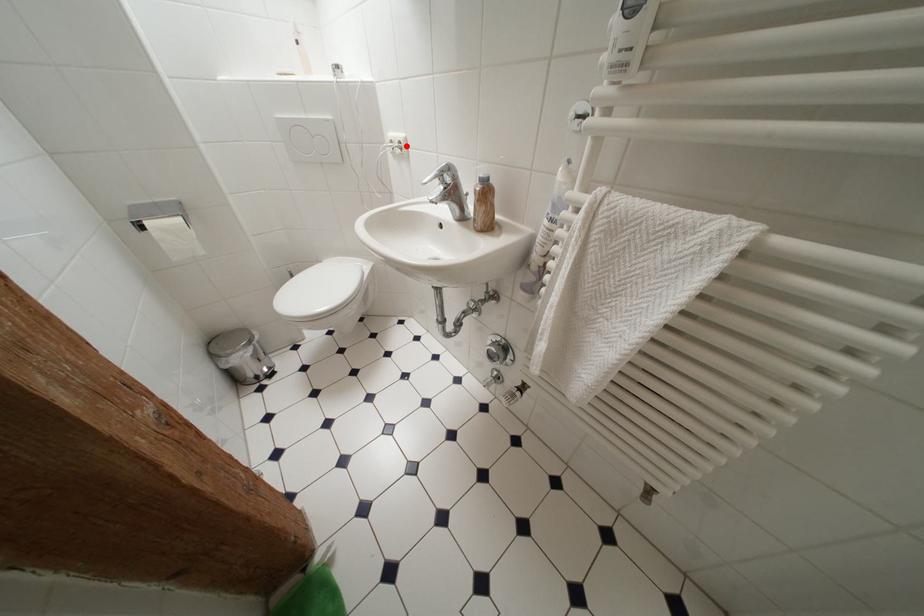
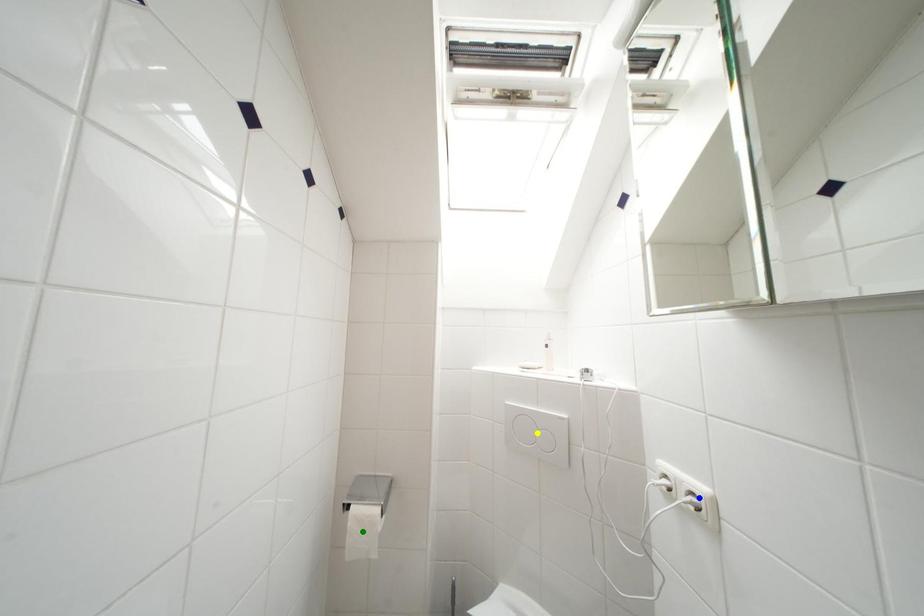
Question: I am providing you with two images of the same scene from different viewpoints. A red point is marked on the first image. You are given multiple points on the second image. In image 2, which mark is for the same physical point as the one in image 1?

Choices:
 (A) green point
 (B) yellow point
 (C) blue point

Answer: (C)